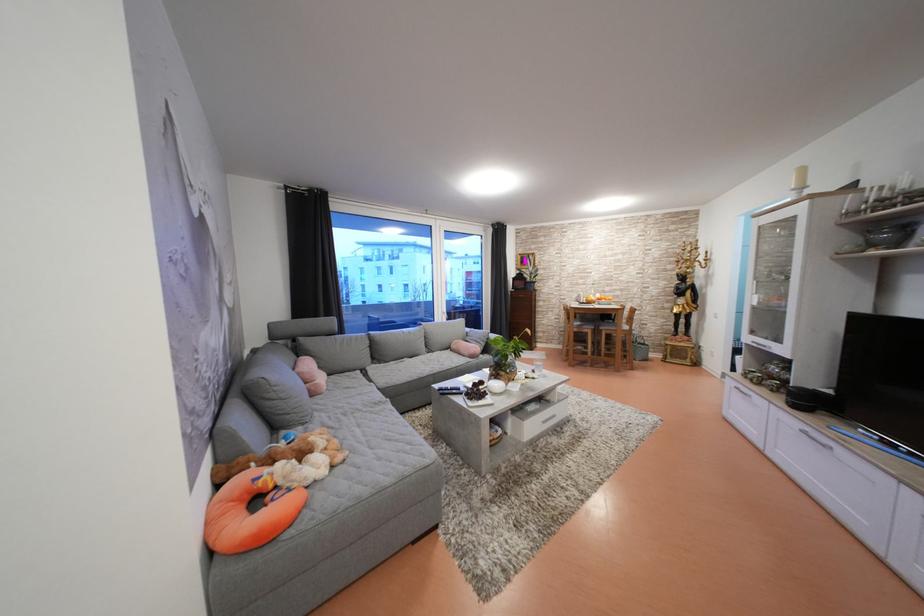
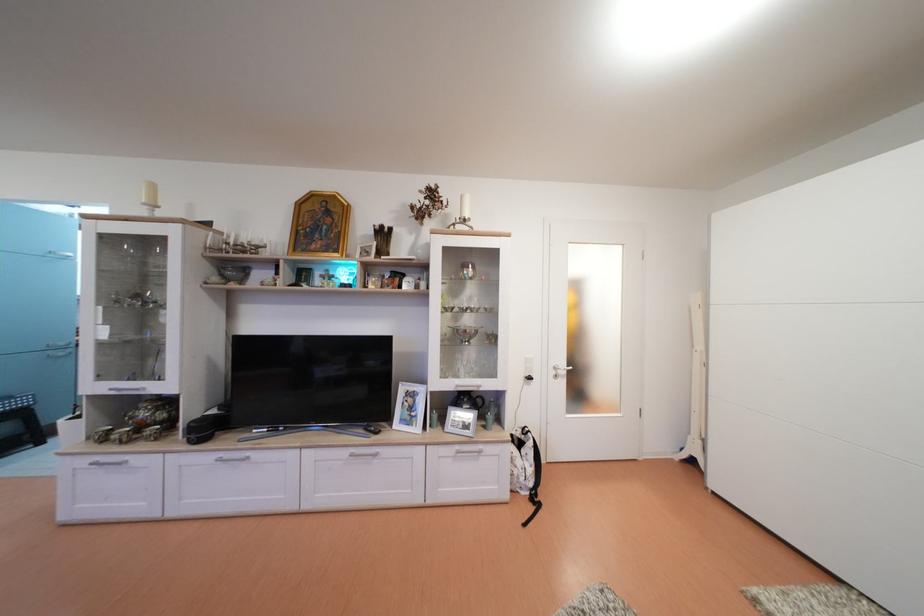
Question: Based on the continuous images, in which direction is the camera rotating? Reply with the corresponding letter.

Choices:
 (A) Left
 (B) Right
 (C) Up
 (D) Down

Answer: (B)